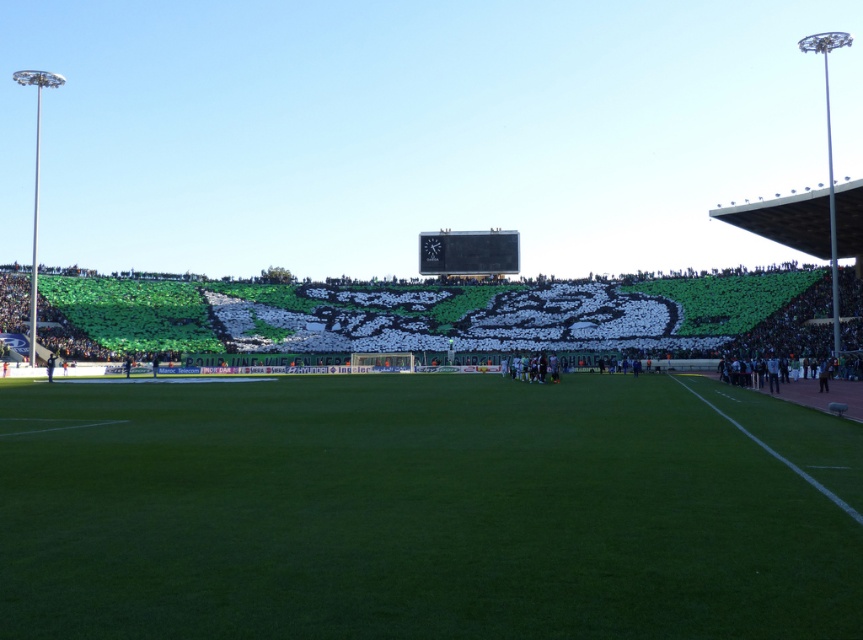
Does point (370, 608) lie behind point (446, 252)?

No, (370, 608) is closer to viewer.

I want to click on green artificial turf at center, so click(x=407, y=513).

Is point (841, 486) behind point (452, 253)?

No, it is not.

The width and height of the screenshot is (863, 640). Identify the location of green artificial turf at center. click(x=407, y=513).